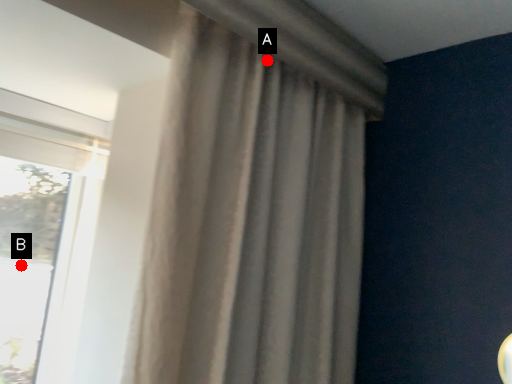
Question: Two points are circled on the image, labeled by A and B beside each circle. Which point is farther to the camera?

Choices:
 (A) A is further
 (B) B is further

Answer: (B)